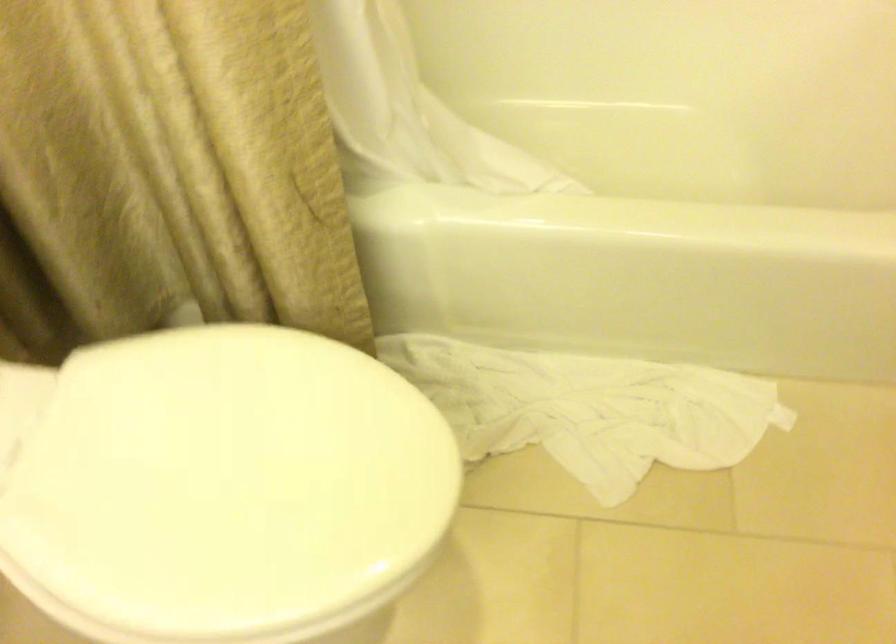
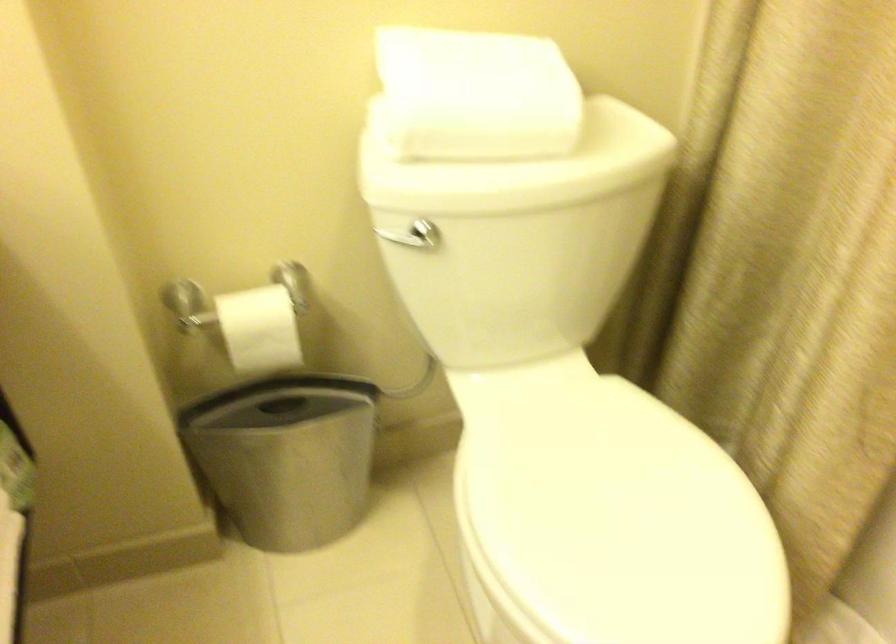
Question: Based on the continuous images, in which direction is the camera rotating? Reply with the corresponding letter.

Choices:
 (A) Left
 (B) Right
 (C) Up
 (D) Down

Answer: (A)